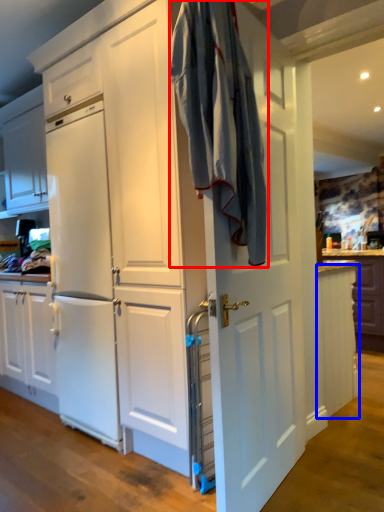
Question: Which object appears closest to the camera in this image, laundry (highlighted by a red box) or cabinetry (highlighted by a blue box)?

Choices:
 (A) laundry
 (B) cabinetry

Answer: (A)